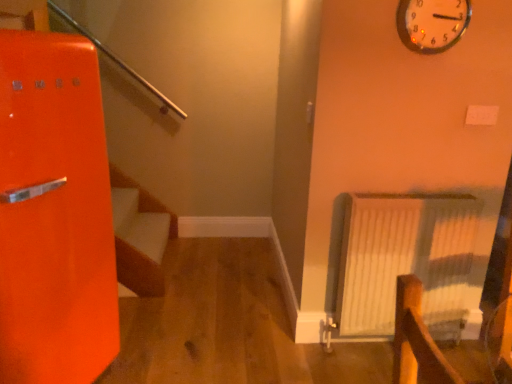
Question: Does metallic silver clock at upper right have a smaller size compared to white textured radiator at right?

Choices:
 (A) yes
 (B) no

Answer: (A)

Question: Considering the relative sizes of metallic silver clock at upper right and white textured radiator at right in the image provided, is metallic silver clock at upper right bigger than white textured radiator at right?

Choices:
 (A) no
 (B) yes

Answer: (A)

Question: Is there a large distance between metallic silver clock at upper right and white textured radiator at right?

Choices:
 (A) no
 (B) yes

Answer: (A)

Question: From the image's perspective, does metallic silver clock at upper right appear higher than white textured radiator at right?

Choices:
 (A) no
 (B) yes

Answer: (B)

Question: Is the depth of metallic silver clock at upper right greater than that of white textured radiator at right?

Choices:
 (A) yes
 (B) no

Answer: (B)

Question: Is metallic silver clock at upper right not within white textured radiator at right?

Choices:
 (A) no
 (B) yes

Answer: (B)

Question: Is white textured radiator at right positioned beyond the bounds of metallic silver clock at upper right?

Choices:
 (A) no
 (B) yes

Answer: (B)

Question: Does white textured radiator at right have a smaller size compared to metallic silver clock at upper right?

Choices:
 (A) no
 (B) yes

Answer: (A)

Question: Considering the relative sizes of white textured radiator at right and metallic silver clock at upper right in the image provided, is white textured radiator at right taller than metallic silver clock at upper right?

Choices:
 (A) no
 (B) yes

Answer: (B)

Question: Could you tell me if white textured radiator at right is turned towards metallic silver clock at upper right?

Choices:
 (A) no
 (B) yes

Answer: (A)

Question: Is white textured radiator at right thinner than metallic silver clock at upper right?

Choices:
 (A) no
 (B) yes

Answer: (A)

Question: Is white textured radiator at right touching metallic silver clock at upper right?

Choices:
 (A) no
 (B) yes

Answer: (A)

Question: From the image's perspective, is metallic silver clock at upper right positioned above or below white textured radiator at right?

Choices:
 (A) below
 (B) above

Answer: (B)